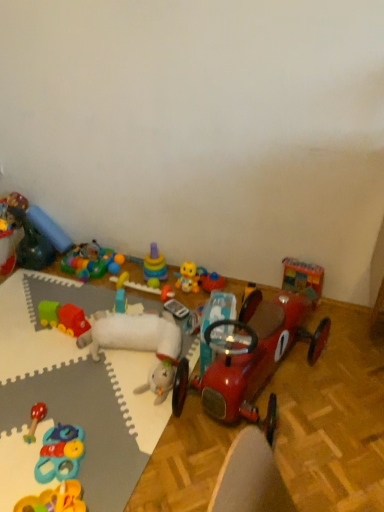
Locate an element on the screen. vacant space to the left of rubberized plastic rings at center, which is counted as the fourth toy, starting from the right is located at coordinates (99, 293).